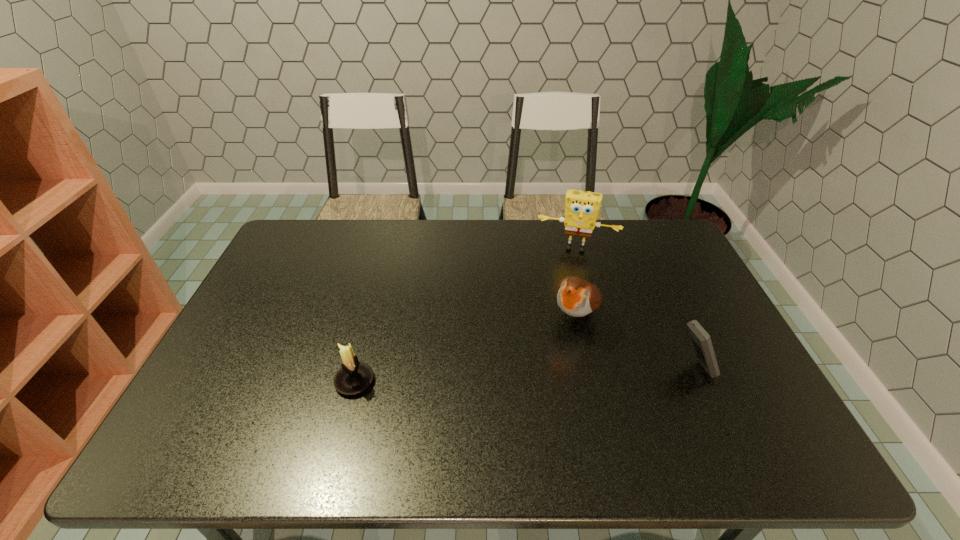
Identify the location of vacant position located 0.210m at the face of the second farthest object. (531, 392).

The width and height of the screenshot is (960, 540). I want to click on vacant point located 0.160m at the face of the second farthest object, so [540, 377].

Image resolution: width=960 pixels, height=540 pixels. In order to click on object located in the far edge section of the desktop in this screenshot , I will do [x=582, y=208].

Where is `object that is at the near edge`? This screenshot has width=960, height=540. object that is at the near edge is located at coordinates (354, 377).

Where is `object located at the right edge`? This screenshot has width=960, height=540. object located at the right edge is located at coordinates (701, 339).

Find the location of a particular element. The image size is (960, 540). free space at the far edge of the desktop is located at coordinates (554, 225).

Locate an element on the screen. blank area at the near edge is located at coordinates (336, 421).

The width and height of the screenshot is (960, 540). I want to click on vacant space at the left edge of the desktop, so click(x=235, y=330).

Identify the location of vacant space at the right edge of the desktop. (722, 342).

What are the coordinates of `blank space at the far left corner of the desktop` in the screenshot? It's located at (284, 243).